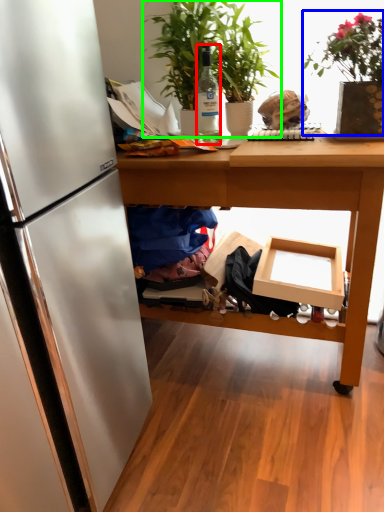
Question: Based on their relative distances, which object is farther from bottle (highlighted by a red box)? Choose from houseplant (highlighted by a blue box) and houseplant (highlighted by a green box).

Choices:
 (A) houseplant
 (B) houseplant

Answer: (A)